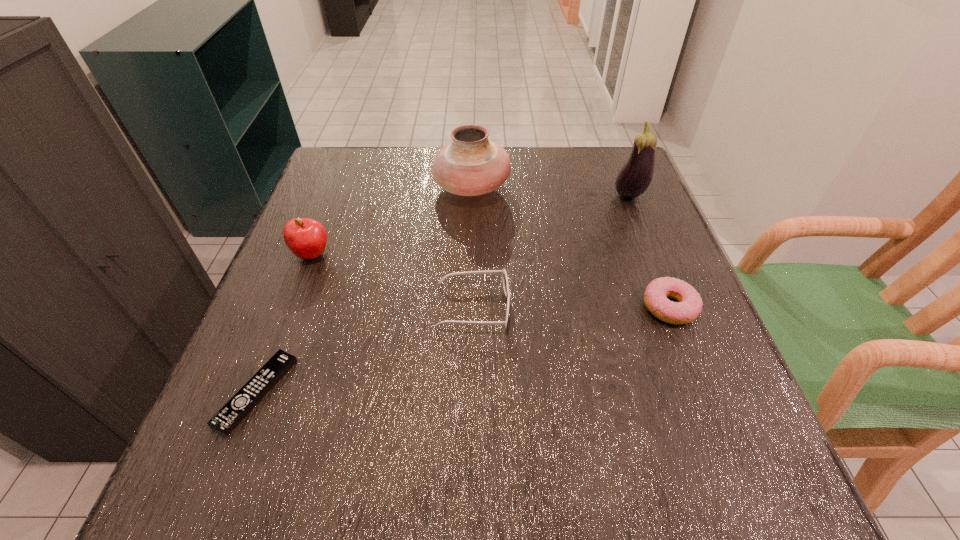
This screenshot has height=540, width=960. I want to click on vacant space that's between the remote control and the second tallest object, so click(x=364, y=289).

The image size is (960, 540). What are the coordinates of `free space between the apple and the doughnut` in the screenshot? It's located at (491, 281).

The width and height of the screenshot is (960, 540). In order to click on free area in between the sunglasses and the tallest object in this screenshot , I will do click(551, 251).

This screenshot has width=960, height=540. What are the coordinates of `blank region between the third farthest object and the eggplant` in the screenshot? It's located at (470, 225).

Identify the location of unoccupied position between the tallest object and the fourth nearest object. The image size is (960, 540). (470, 225).

Image resolution: width=960 pixels, height=540 pixels. I want to click on vacant area that lies between the doughnut and the fourth shortest object, so click(491, 281).

The image size is (960, 540). What are the coordinates of `vacant space in between the sunglasses and the pottery` in the screenshot? It's located at (472, 246).

Where is `free space between the third farthest object and the shortest object`? This screenshot has height=540, width=960. free space between the third farthest object and the shortest object is located at coordinates (284, 323).

Identify which object is the fifth nearest to the sunglasses. Please provide its 2D coordinates. Your answer should be formatted as a tuple, i.e. [(x, y)], where the tuple contains the x and y coordinates of a point satisfying the conditions above.

[(634, 178)]

Point out which object is positioned as the fifth nearest to the sunglasses. Please provide its 2D coordinates. Your answer should be formatted as a tuple, i.e. [(x, y)], where the tuple contains the x and y coordinates of a point satisfying the conditions above.

[(634, 178)]